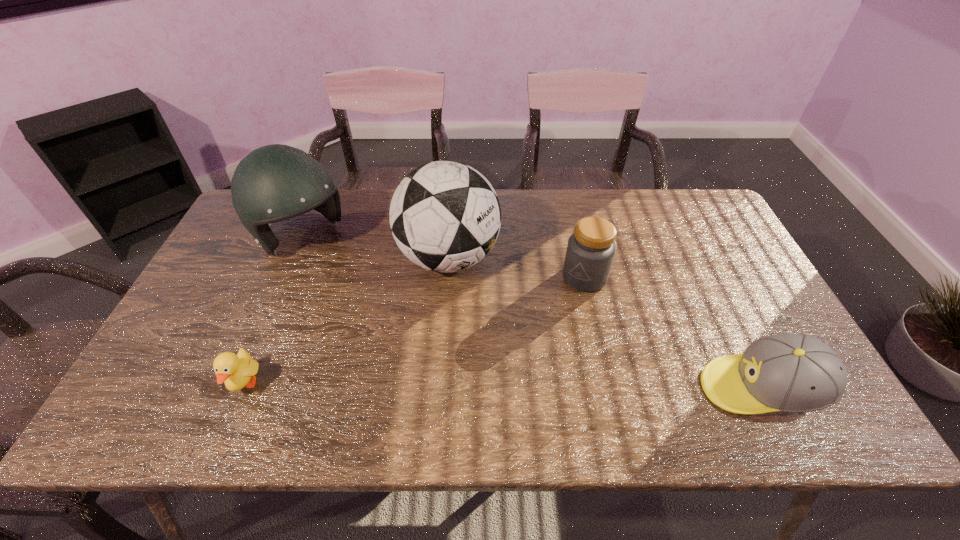
Where is `free space between the jar and the soccer ball`? free space between the jar and the soccer ball is located at coordinates (516, 267).

Identify the location of free space between the duckling and the soccer ball. The image size is (960, 540). (347, 321).

Locate which object is the second closest to the duckling. Please provide its 2D coordinates. Your answer should be formatted as a tuple, i.e. [(x, y)], where the tuple contains the x and y coordinates of a point satisfying the conditions above.

[(445, 216)]

Identify which object is located as the nearest to the football helmet. Please provide its 2D coordinates. Your answer should be formatted as a tuple, i.e. [(x, y)], where the tuple contains the x and y coordinates of a point satisfying the conditions above.

[(445, 216)]

Find the location of a particular element. Image resolution: width=960 pixels, height=540 pixels. vacant area that satisfies the following two spatial constraints: 1. on the front side of the fourth object from left to right; 2. on the left side of the football helmet is located at coordinates (284, 277).

The height and width of the screenshot is (540, 960). What are the coordinates of `vacant space that satisfies the following two spatial constraints: 1. on the front-facing side of the shortest object; 2. on the front-facing side of the second shortest object` in the screenshot? It's located at click(x=243, y=389).

Locate an element on the screen. Image resolution: width=960 pixels, height=540 pixels. free space that satisfies the following two spatial constraints: 1. on the front side of the third object from right to left; 2. on the right side of the third tallest object is located at coordinates (447, 277).